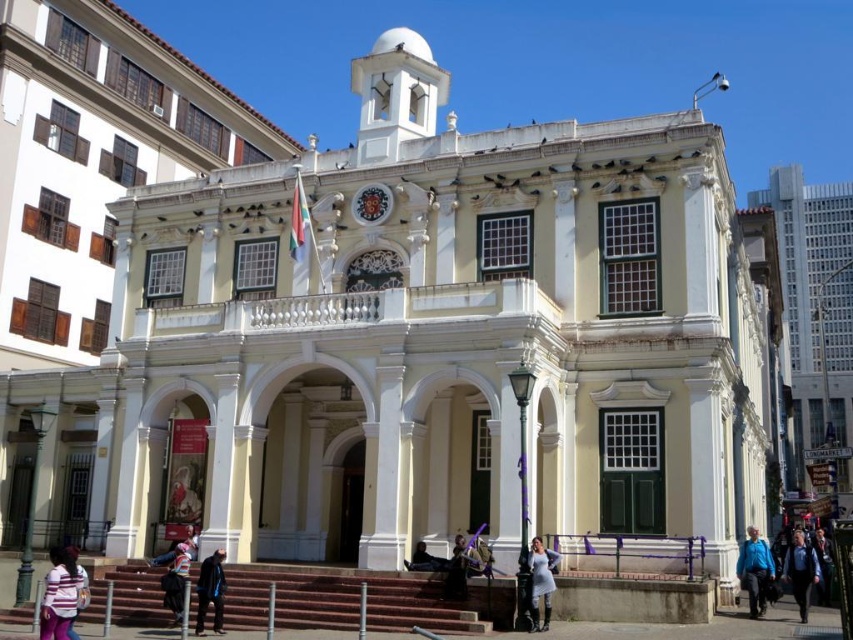
Question: Does blue fabric jacket at lower right appear under blue denim jacket at lower right?

Choices:
 (A) yes
 (B) no

Answer: (B)

Question: Does blue denim jacket at lower right have a smaller size compared to dark blue fabric coat at lower center?

Choices:
 (A) no
 (B) yes

Answer: (A)

Question: Which point appears farthest from the camera in this image?

Choices:
 (A) (410, 556)
 (B) (80, 570)
 (C) (74, 557)
 (D) (547, 614)

Answer: (A)

Question: Is metallic clock face at center closer to camera compared to dark blue fabric coat at lower center?

Choices:
 (A) no
 (B) yes

Answer: (A)

Question: Among these objects, which one is farthest from the camera?

Choices:
 (A) gray fabric dress at lower center
 (B) blue fabric jacket at lower right
 (C) blue denim jacket at lower right
 (D) striped shirt at lower left

Answer: (B)

Question: Among these objects, which one is nearest to the camera?

Choices:
 (A) striped sweater at lower left
 (B) dark blue jacket at lower center
 (C) gray fabric dress at lower center
 (D) striped shirt at lower left

Answer: (D)